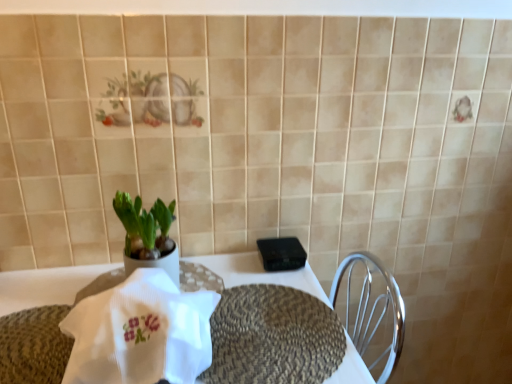
Locate an element on the screen. The image size is (512, 384). empty space that is ontop of braided woven placemat at center (from a real-world perspective) is located at coordinates (271, 331).